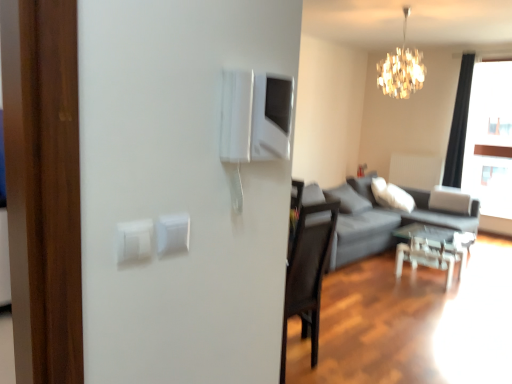
Question: Considering the relative sizes of dark gray fabric couch at right and white plastic light switch at center, which appears as the first light switch when viewed from the back, in the image provided, is dark gray fabric couch at right thinner than white plastic light switch at center, which appears as the first light switch when viewed from the back,?

Choices:
 (A) yes
 (B) no

Answer: (B)

Question: Does dark gray fabric couch at right have a greater width compared to white plastic light switch at center, acting as the first light switch starting from the right?

Choices:
 (A) yes
 (B) no

Answer: (A)

Question: Considering the relative sizes of dark gray fabric couch at right and white plastic light switch at center, acting as the first light switch starting from the right, in the image provided, is dark gray fabric couch at right shorter than white plastic light switch at center, acting as the first light switch starting from the right,?

Choices:
 (A) no
 (B) yes

Answer: (A)

Question: Can we say dark gray fabric couch at right lies outside white plastic light switch at center, which appears as the first light switch when viewed from the back?

Choices:
 (A) yes
 (B) no

Answer: (A)

Question: From the image's perspective, is dark gray fabric couch at right beneath white plastic light switch at center, which appears as the first light switch when viewed from the back?

Choices:
 (A) no
 (B) yes

Answer: (B)

Question: Considering the positions of transparent glass table at lower right and white plastic radiator at upper right in the image, is transparent glass table at lower right wider or thinner than white plastic radiator at upper right?

Choices:
 (A) wide
 (B) thin

Answer: (A)

Question: In terms of size, does transparent glass table at lower right appear bigger or smaller than white plastic radiator at upper right?

Choices:
 (A) big
 (B) small

Answer: (A)

Question: Is transparent glass table at lower right taller or shorter than white plastic radiator at upper right?

Choices:
 (A) tall
 (B) short

Answer: (B)

Question: Is transparent glass table at lower right inside or outside of white plastic radiator at upper right?

Choices:
 (A) outside
 (B) inside

Answer: (A)

Question: Is black fabric curtain at upper right inside the boundaries of shiny crystal chandelier at upper center, or outside?

Choices:
 (A) outside
 (B) inside

Answer: (A)

Question: Looking at their shapes, would you say black fabric curtain at upper right is wider or thinner than shiny crystal chandelier at upper center?

Choices:
 (A) wide
 (B) thin

Answer: (B)

Question: From their relative heights in the image, would you say black fabric curtain at upper right is taller or shorter than shiny crystal chandelier at upper center?

Choices:
 (A) short
 (B) tall

Answer: (B)

Question: From a real-world perspective, is black fabric curtain at upper right positioned above or below shiny crystal chandelier at upper center?

Choices:
 (A) above
 (B) below

Answer: (B)

Question: Is white plastic light switch at upper left, marked as the 1th light switch in a front-to-back arrangement, in front of or behind dark gray fabric couch at right in the image?

Choices:
 (A) front
 (B) behind

Answer: (A)

Question: Is white plastic light switch at upper left, marked as the 1th light switch in a front-to-back arrangement, to the left or to the right of dark gray fabric couch at right in the image?

Choices:
 (A) right
 (B) left

Answer: (B)